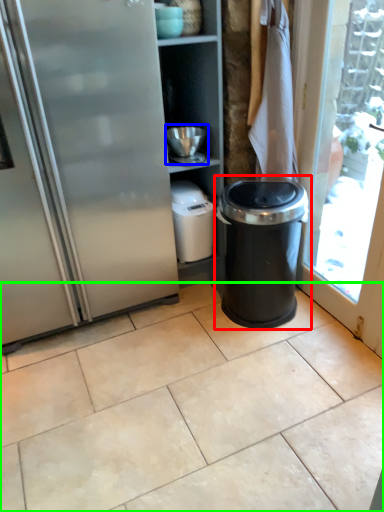
Question: Based on their relative distances, which object is farther from waste container (highlighted by a red box)? Choose from appliance (highlighted by a blue box) and ceramic tile (highlighted by a green box).

Choices:
 (A) appliance
 (B) ceramic tile

Answer: (B)